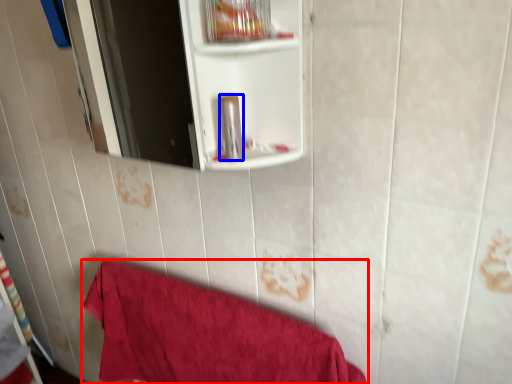
Question: Which object appears closest to the camera in this image, towel (highlighted by a red box) or toiletry (highlighted by a blue box)?

Choices:
 (A) towel
 (B) toiletry

Answer: (B)